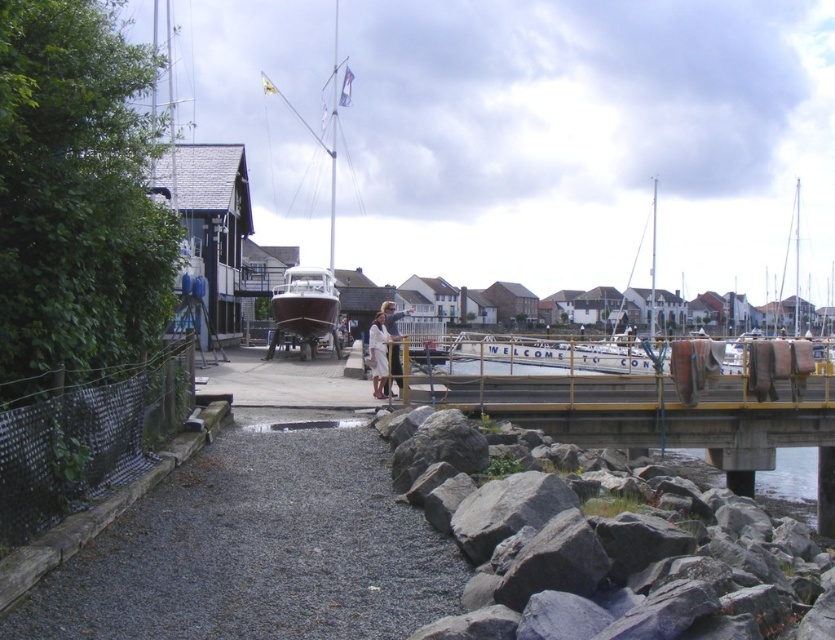
You are standing on the gravel path near the dark gray rocks and want to move to the wooden walkway with the yellow railing. There is a matte brown boat at center and a white cotton dress at center in your way. Can you walk between them without needing to go around?

The matte brown boat at center and the white cotton dress at center are 7.01 meters apart, so there is enough space to walk between them without needing to go around.

You are a photographer planning to take a portrait of two people wearing the white cotton dress at center and the white fabric shirt at center. Since you want to emphasize their height difference, which clothing item should you place closer to the camera to make the person appear taller?

The white fabric shirt at center should be placed closer to the camera because it is taller than the white cotton dress at center, so positioning it nearer will exaggerate its apparent height due to perspective.

You are standing on the gravel path and want to board the matte brown boat at center. The white fabric shirt at center is blocking your path. Since the boat is narrower, can you walk around it on either side?

The matte brown boat at center has a lesser width compared to white fabric shirt at center, so you can walk around the white fabric shirt at center on either side since the boat is narrower.